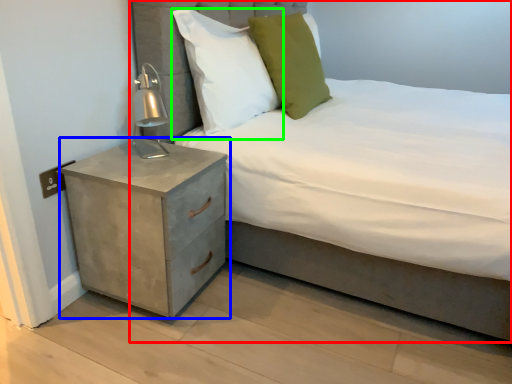
Question: Which object is positioned farthest from bed (highlighted by a red box)? Select from nightstand (highlighted by a blue box) and pillow (highlighted by a green box).

Choices:
 (A) nightstand
 (B) pillow

Answer: (B)